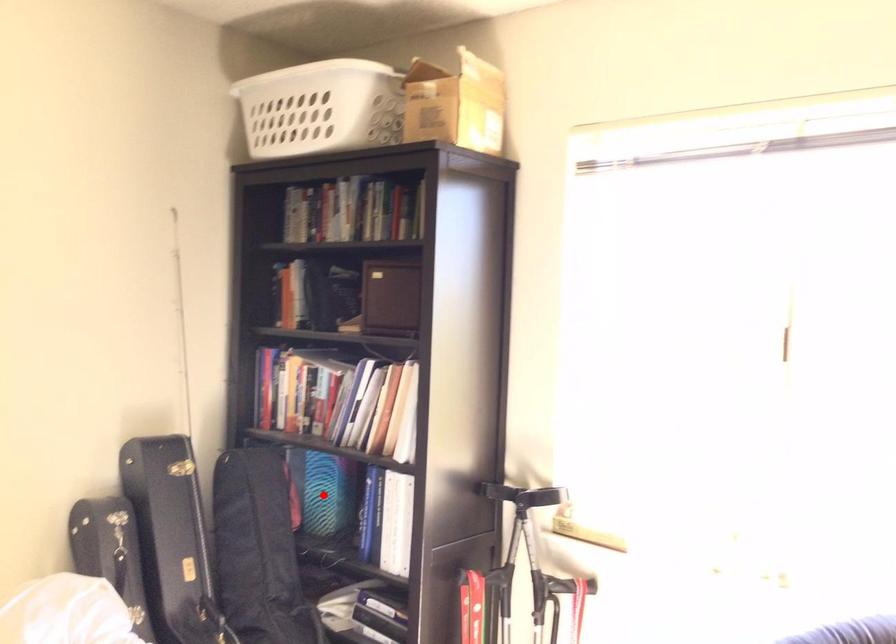
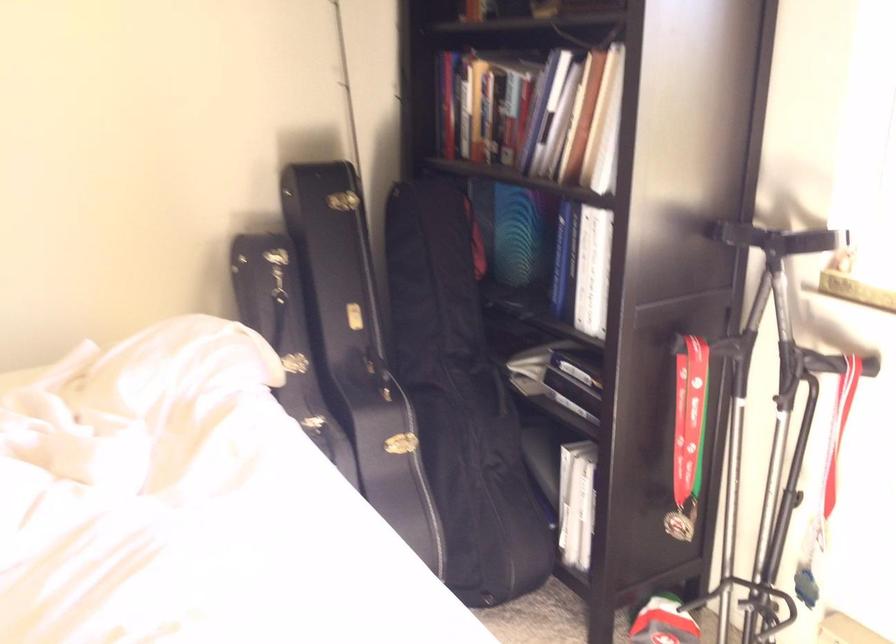
Question: A red point is marked in image1. In image2, is the corresponding 3D point closer to the camera or farther? Reply with the corresponding letter.

Choices:
 (A) The corresponding 3D point is closer.
 (B) The corresponding 3D point is farther.

Answer: (A)